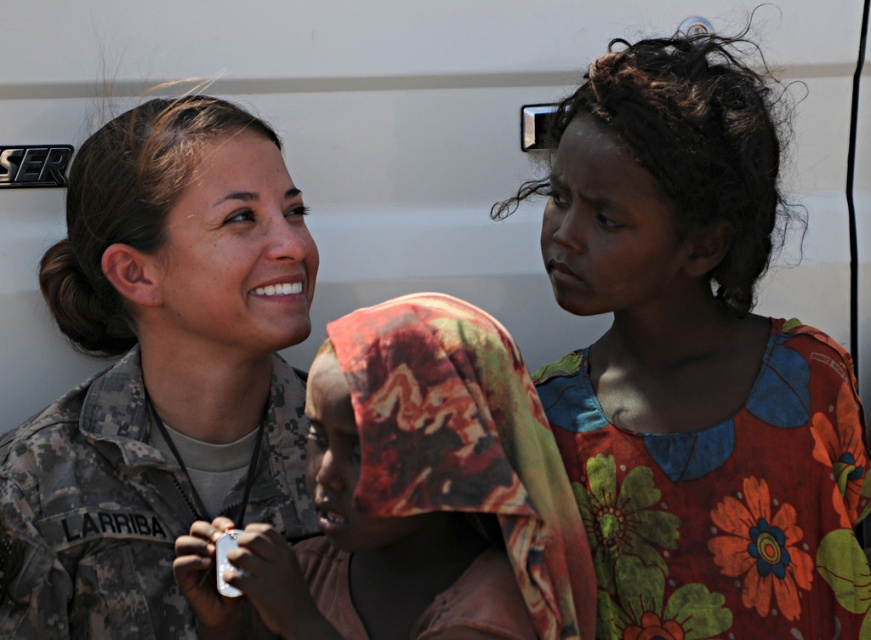
You are an observer analyzing the image. Please determine the relative positions of the camouflage uniform at center and the printed fabric headscarf at center. Which object is located to the left?

The camouflage uniform at center is positioned on the left side of the printed fabric headscarf at center, so the camouflage uniform at center is located to the left.

You are an observer analyzing the image. Which object, the camouflage uniform at center or the printed fabric headscarf at center, appears narrower in the scene?

The camouflage uniform at center has a lesser width compared to the printed fabric headscarf at center, so the camouflage uniform at center appears narrower.